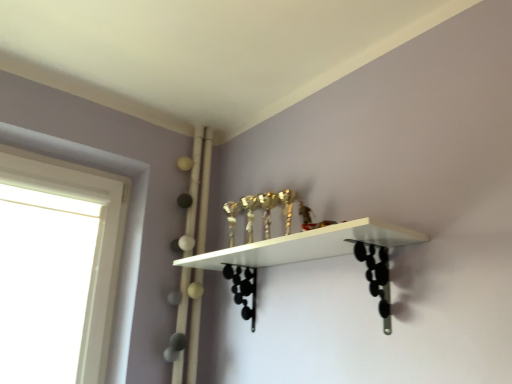
What do you see at coordinates (306, 245) in the screenshot? I see `white glossy shelf at upper center` at bounding box center [306, 245].

The height and width of the screenshot is (384, 512). I want to click on white glossy shelf at upper center, so [306, 245].

Measure the distance between point (x=199, y=256) and camera.

The distance of point (x=199, y=256) from camera is 1.72 meters.

This screenshot has height=384, width=512. I want to click on white glossy shelf at upper center, so click(306, 245).